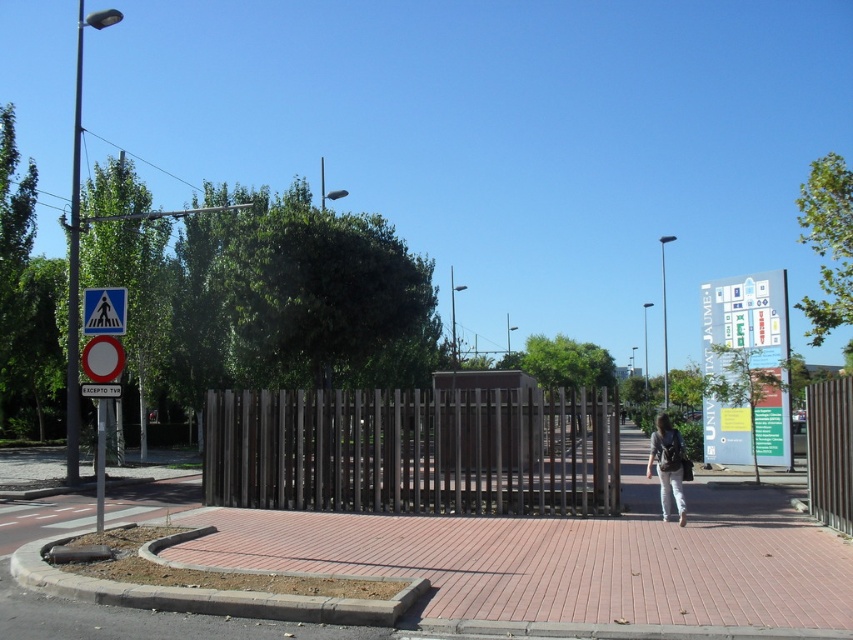
You are standing at the origin point of the coordinate system in the image. You want to walk to the brown wooden fence at center. Which direction should you move in terms of the coordinate system?

To reach the brown wooden fence at center located at point (415, 451) in the coordinate system, you should move in the positive x and positive y direction since both coordinates are greater than the origin point at (0, 0).

You are a delivery person trying to see if you can fit a package through the space between the brown wooden fence at center and the white denim pants at center. Based on their heights, can the package pass through?

The brown wooden fence at center is taller than the white denim pants at center, so the package can pass through the space between them as long as it is shorter than the white denim pants at center.